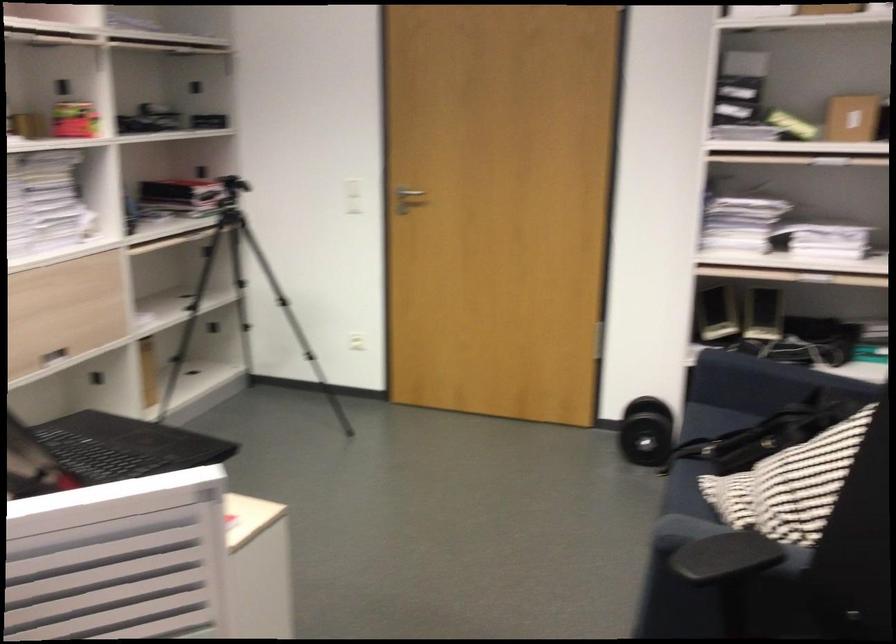
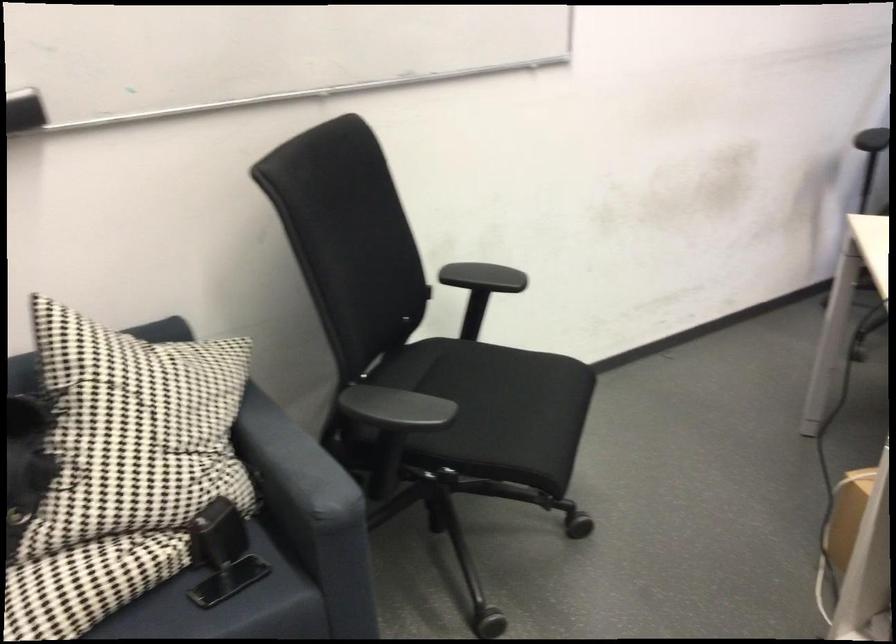
The point at [739,541] is marked in the first image. Where is the corresponding point in the second image?

(293, 464)